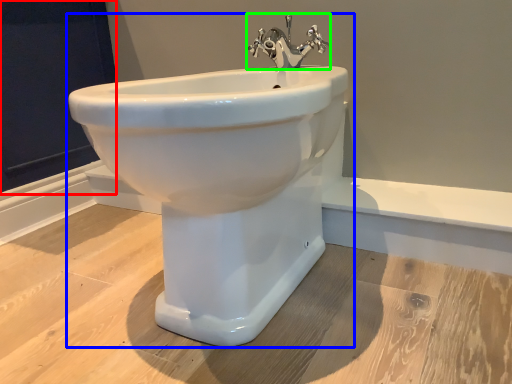
Question: Considering the real-world distances, which object is farthest from screen door (highlighted by a red box)? sink (highlighted by a blue box) or tap (highlighted by a green box)?

Choices:
 (A) sink
 (B) tap

Answer: (A)